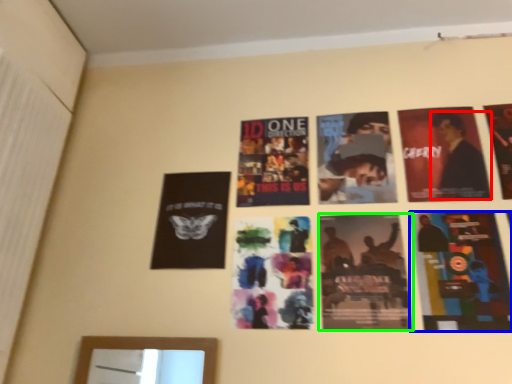
Question: Which object is positioned farthest from person (highlighted by a red box)? Select from poster (highlighted by a blue box) and poster (highlighted by a green box).

Choices:
 (A) poster
 (B) poster

Answer: (B)